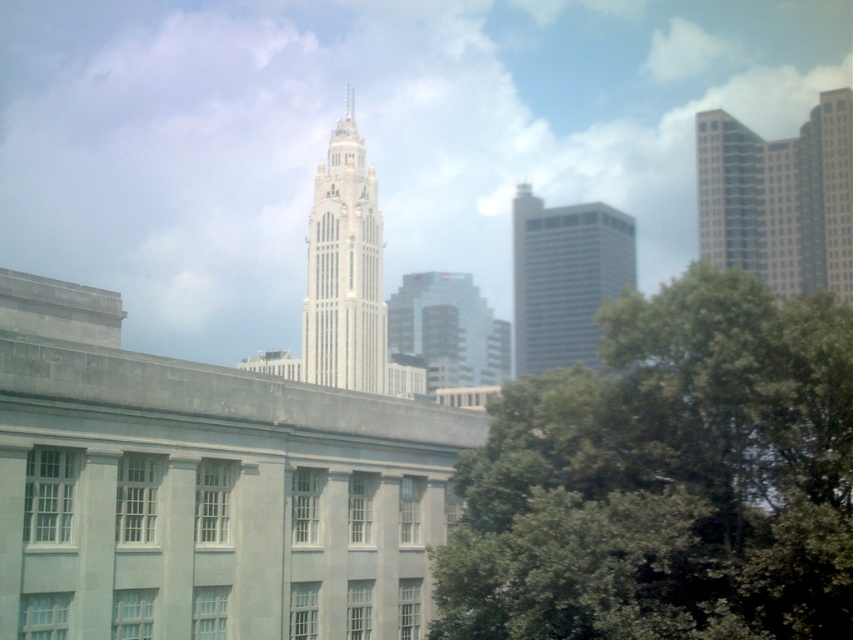
Measure the distance between glassy blue skyscraper at upper right and camera.

glassy blue skyscraper at upper right and camera are 135.87 meters apart.

Looking at this image, can you confirm if glassy blue skyscraper at upper right is taller than gray glass building at center?

Incorrect, glassy blue skyscraper at upper right's height is not larger of gray glass building at center's.

Between point (787, 230) and point (585, 248), which one is positioned behind?

Positioned behind is point (585, 248).

Locate an element on the screen. glassy blue skyscraper at upper right is located at coordinates (779, 198).

Is green leafy tree at center taller than glassy reflective skyscraper at center?

No, green leafy tree at center is not taller than glassy reflective skyscraper at center.

Is point (628, 588) behind point (410, 349)?

No.

I want to click on green leafy tree at center, so click(666, 480).

Is white glass tower at center taller than white glass spire at upper center?

Yes.

Find the location of a particular element. The image size is (853, 640). white glass tower at center is located at coordinates (344, 272).

In the scene shown: Who is more forward, (370, 342) or (347, 92)?

Positioned in front is point (370, 342).

You are a GUI agent. You are given a task and a screenshot of the screen. Output one action in this format:
    pyautogui.click(x=<x>, y=<y>)
    Task: Click on the white glass tower at center
    
    Given the screenshot: What is the action you would take?
    pyautogui.click(x=344, y=272)